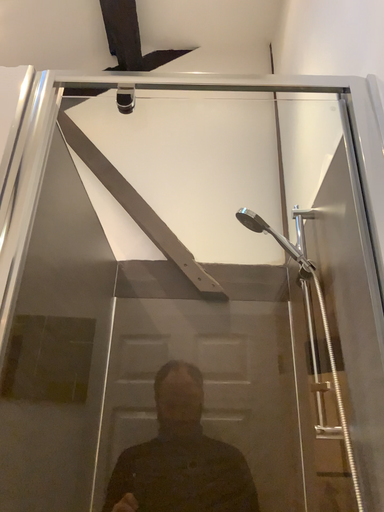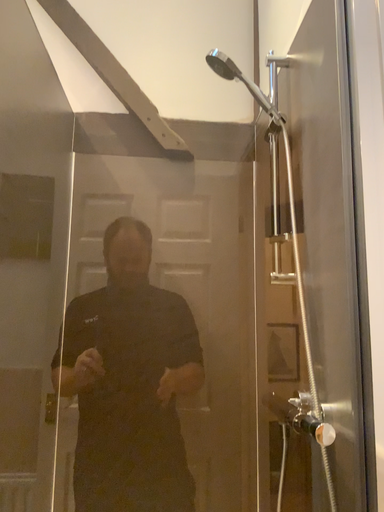
Question: Which way did the camera rotate in the video?

Choices:
 (A) rotated downward
 (B) rotated upward

Answer: (A)